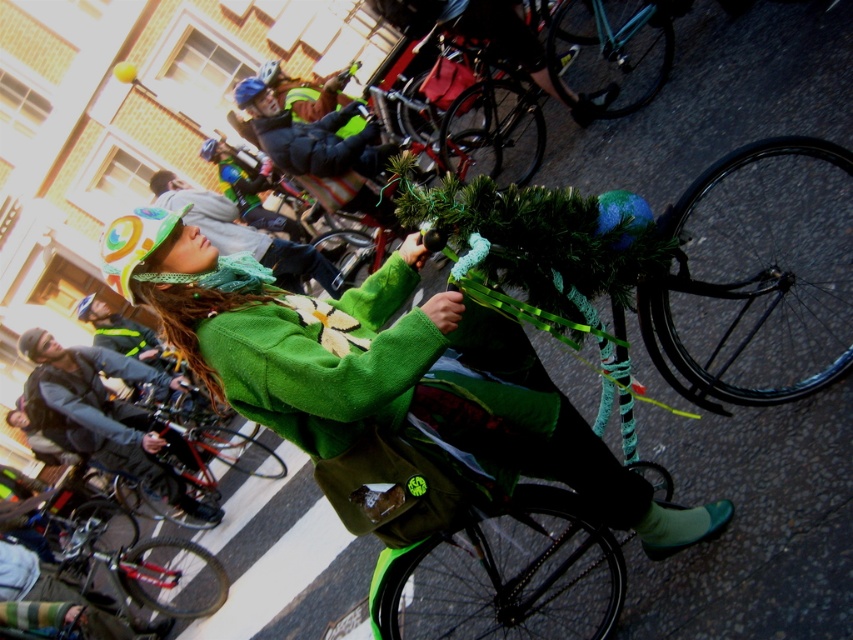
You are a photographer standing in the middle of the street, and you want to take a photo of the two points mentioned in the scene. Which point, point (370, 355) or point (65, 388), is closer to you?

Point (370, 355) is closer to the viewer than point (65, 388).

In the scene shown: You are standing at the center of the image and want to locate the green knitted hat at upper left. In which direction should you look relative to your current position?

The green knitted hat at upper left is located at point 0.605 on the x axis and 0.451 on the y axis, so you should look to the upper left direction from your current position at the center.

You are a photographer at the bicycle parade and want to capture both the green woolen coat at center and the green fuzzy hat at center in a single photo. Which object should you focus on to ensure both are in frame without cropping?

You should focus on the green woolen coat at center because it is larger and will be easier to frame while still including the green fuzzy hat at center in the shot.